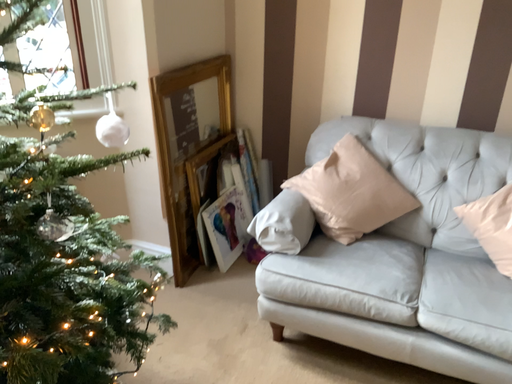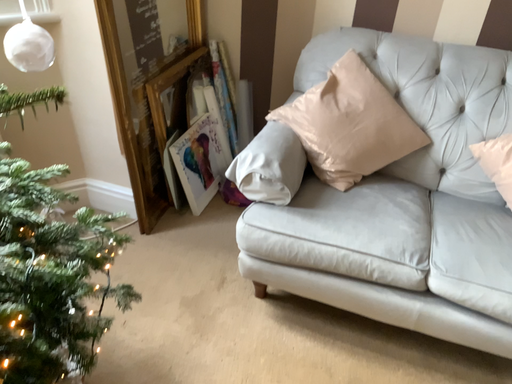
Question: How did the camera likely rotate when shooting the video?

Choices:
 (A) rotated upward
 (B) rotated downward

Answer: (B)